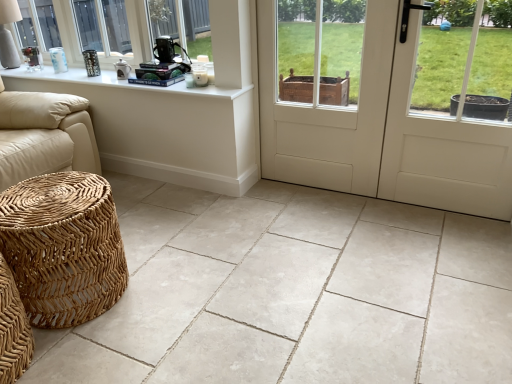
Image resolution: width=512 pixels, height=384 pixels. Find the location of `free space in front of white wood screen door at center`. free space in front of white wood screen door at center is located at coordinates (326, 221).